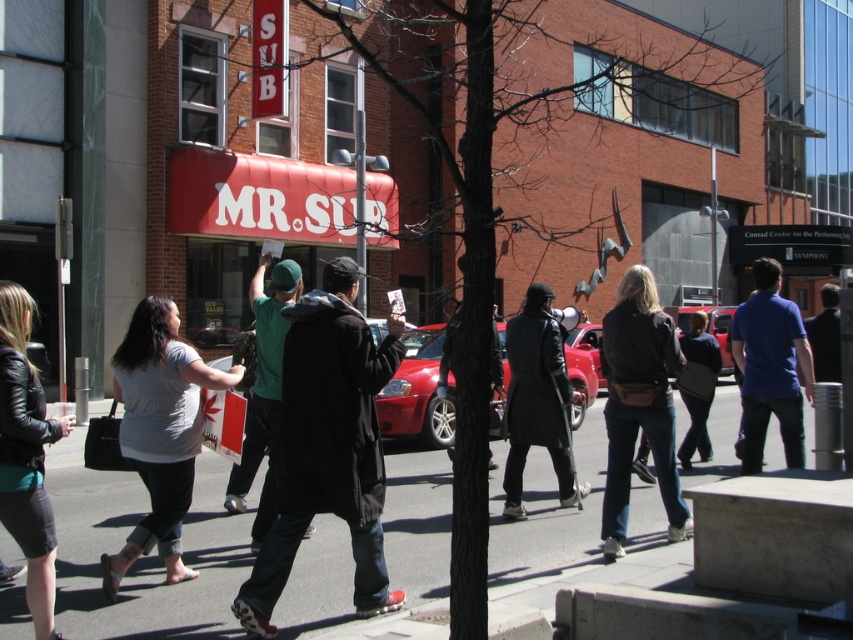
You are standing on the sidewalk and see two points in the scene. The first point is at coordinate point (299, 504) and the second point is at coordinate point (759, 433). Which point is closer to you?

Point (299, 504) is closer to the viewer than point (759, 433).